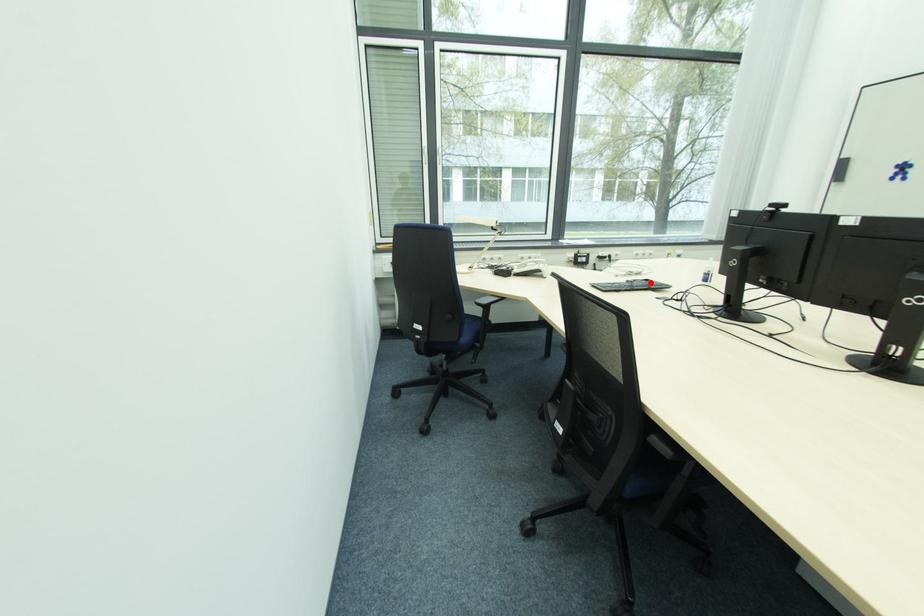
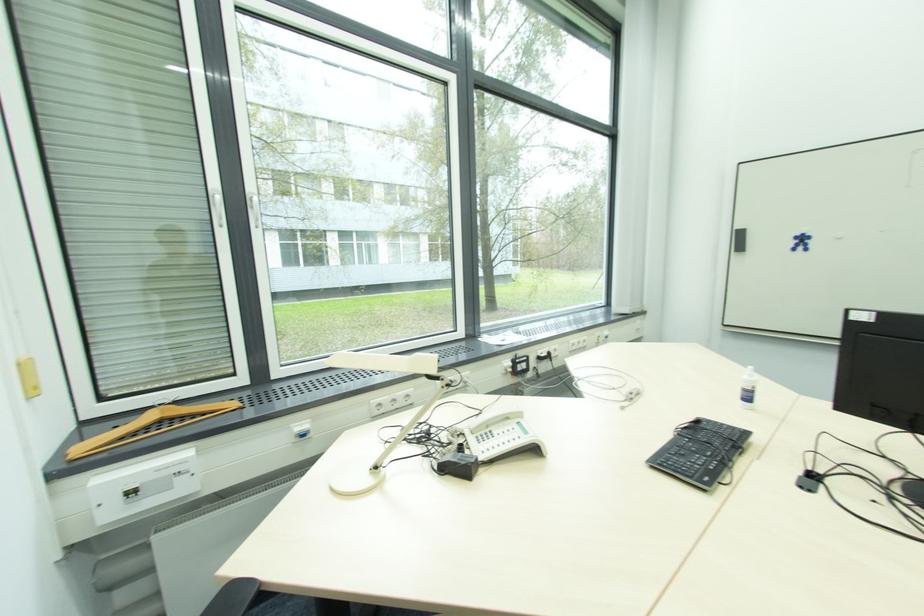
Find the pixel in the second image that matches the highlighted location in the first image.

(700, 424)